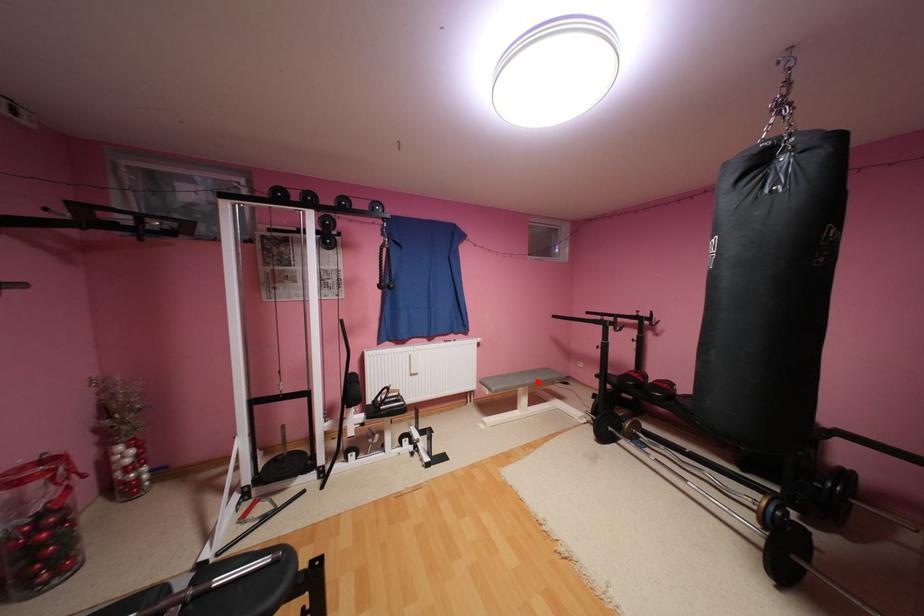
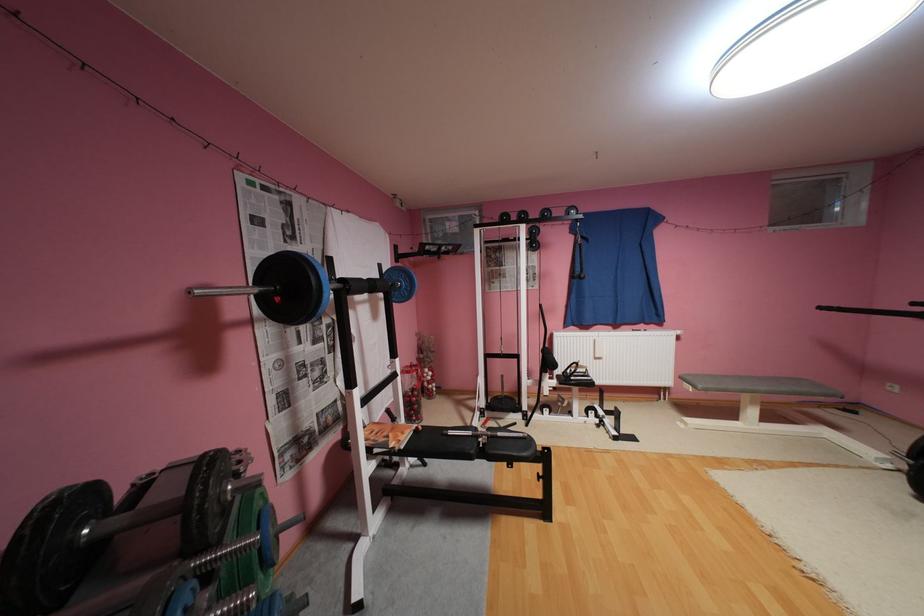
Find the pixel in the second image that matches the highlighted location in the first image.

(771, 387)